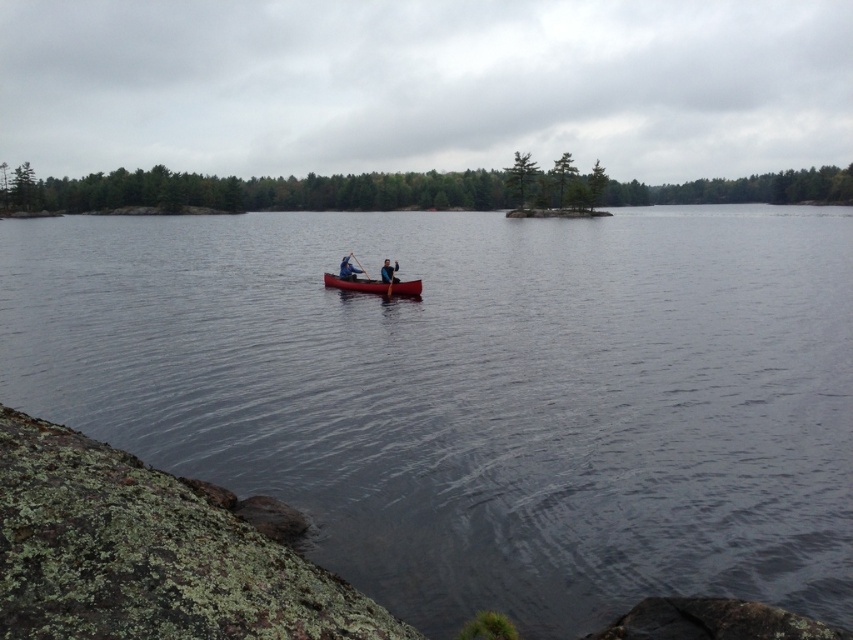
You are standing on the rocky outcrop in the foreground and want to reach the dense line in the background. The path leads past the dark gray water at center and the matte red canoe at center. Which object will you encounter first?

The dark gray water at center is in front of the matte red canoe at center, so you will encounter the dark gray water at center first before reaching the matte red canoe at center.

You are a photographer standing on the lakeside. You want to capture a photo of the matte red canoe at center and the blue fabric person at center together in the frame. The minimum distance between them required for your camera to focus on both is 30 inches. Will you be able to achieve this?

The matte red canoe at center and blue fabric person at center are 29.21 inches apart from each other, which is less than the required 30 inches. Therefore, you can capture both in focus as the distance is within the camera focus range.

You are standing on the lakeside and see the blue fabric jacket at center and the blue fabric person at center. Which one is higher in the scene?

The blue fabric jacket at center is located above the blue fabric person at center, so the blue fabric jacket at center is higher in the scene.